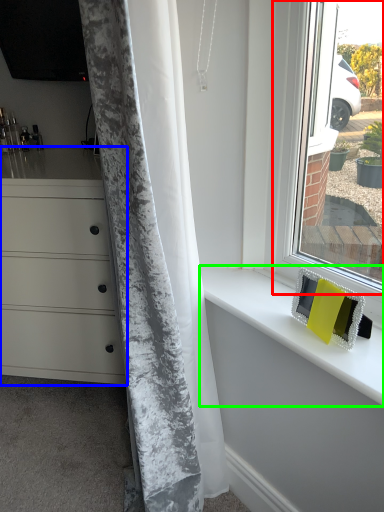
Question: Considering the real-world distances, which object is closest to window (highlighted by a red box)? chest of drawers (highlighted by a blue box) or counter top (highlighted by a green box).

Choices:
 (A) chest of drawers
 (B) counter top

Answer: (B)